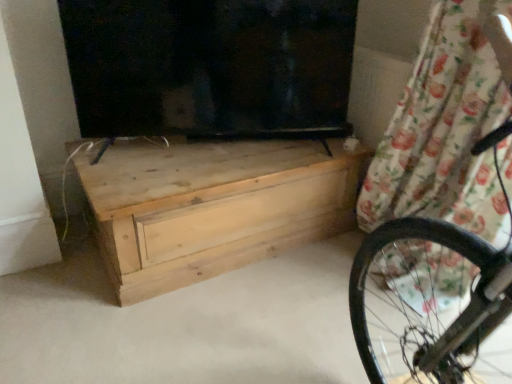
Question: Is floral fabric curtain at upper right positioned behind natural wood chest of drawers at center?

Choices:
 (A) yes
 (B) no

Answer: (B)

Question: Is floral fabric curtain at upper right positioned far away from natural wood chest of drawers at center?

Choices:
 (A) yes
 (B) no

Answer: (B)

Question: Could you tell me if floral fabric curtain at upper right is facing natural wood chest of drawers at center?

Choices:
 (A) yes
 (B) no

Answer: (B)

Question: Does floral fabric curtain at upper right appear on the left side of natural wood chest of drawers at center?

Choices:
 (A) yes
 (B) no

Answer: (B)

Question: Is floral fabric curtain at upper right bigger than natural wood chest of drawers at center?

Choices:
 (A) no
 (B) yes

Answer: (A)

Question: Does floral fabric curtain at upper right have a lesser width compared to natural wood chest of drawers at center?

Choices:
 (A) no
 (B) yes

Answer: (B)

Question: Is natural wood chest of drawers at center positioned far away from floral fabric curtain at upper right?

Choices:
 (A) no
 (B) yes

Answer: (A)

Question: Considering the relative positions of natural wood chest of drawers at center and floral fabric curtain at upper right in the image provided, is natural wood chest of drawers at center to the left of floral fabric curtain at upper right from the viewer's perspective?

Choices:
 (A) no
 (B) yes

Answer: (B)

Question: Does natural wood chest of drawers at center have a smaller size compared to floral fabric curtain at upper right?

Choices:
 (A) yes
 (B) no

Answer: (B)

Question: From a real-world perspective, is natural wood chest of drawers at center below floral fabric curtain at upper right?

Choices:
 (A) yes
 (B) no

Answer: (A)

Question: From the image's perspective, is natural wood chest of drawers at center located beneath floral fabric curtain at upper right?

Choices:
 (A) yes
 (B) no

Answer: (A)

Question: Considering the relative sizes of natural wood chest of drawers at center and floral fabric curtain at upper right in the image provided, is natural wood chest of drawers at center shorter than floral fabric curtain at upper right?

Choices:
 (A) yes
 (B) no

Answer: (A)

Question: Is natural wood chest of drawers at center wider or thinner than floral fabric curtain at upper right?

Choices:
 (A) thin
 (B) wide

Answer: (B)